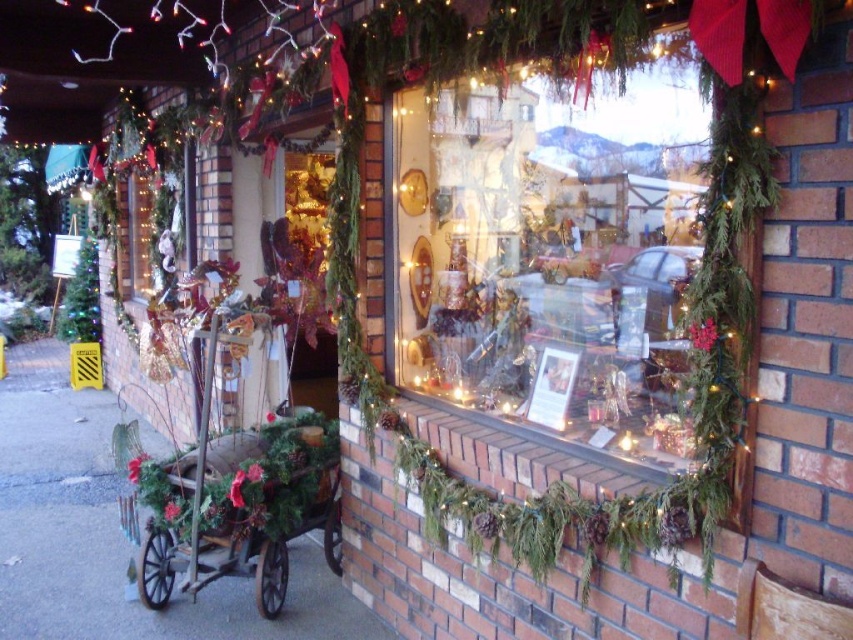
Does matte glass window at center appear over wooden rustic wagon at center?

Correct, matte glass window at center is located above wooden rustic wagon at center.

Measure the distance between matte glass window at center and wooden rustic wagon at center.

matte glass window at center is 38.73 inches away from wooden rustic wagon at center.

Locate an element on the screen. matte glass window at center is located at coordinates [x=550, y=253].

The width and height of the screenshot is (853, 640). I want to click on matte glass window at center, so click(550, 253).